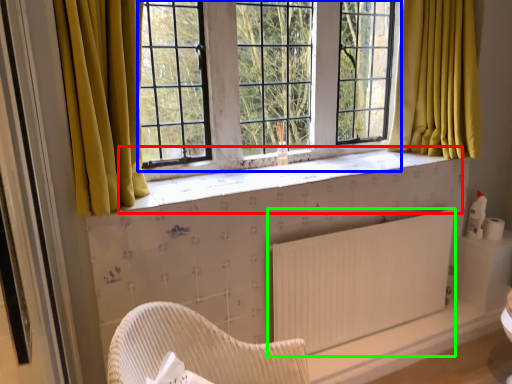
Question: Which is farther away from window sill (highlighted by a red box)? window screen (highlighted by a blue box) or radiator (highlighted by a green box)?

Choices:
 (A) window screen
 (B) radiator

Answer: (B)